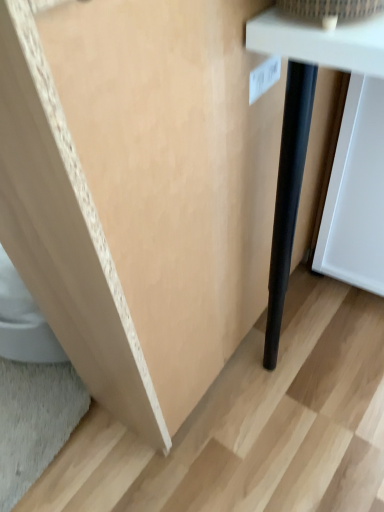
Where is `black matte pole at lower right`? This screenshot has width=384, height=512. black matte pole at lower right is located at coordinates (307, 106).

What do you see at coordinates (307, 106) in the screenshot? I see `black matte pole at lower right` at bounding box center [307, 106].

At what (x,y) coordinates should I click in order to perform the action: click on black matte pole at lower right. Please return your answer as a coordinate pair (x, y). Looking at the image, I should click on (307, 106).